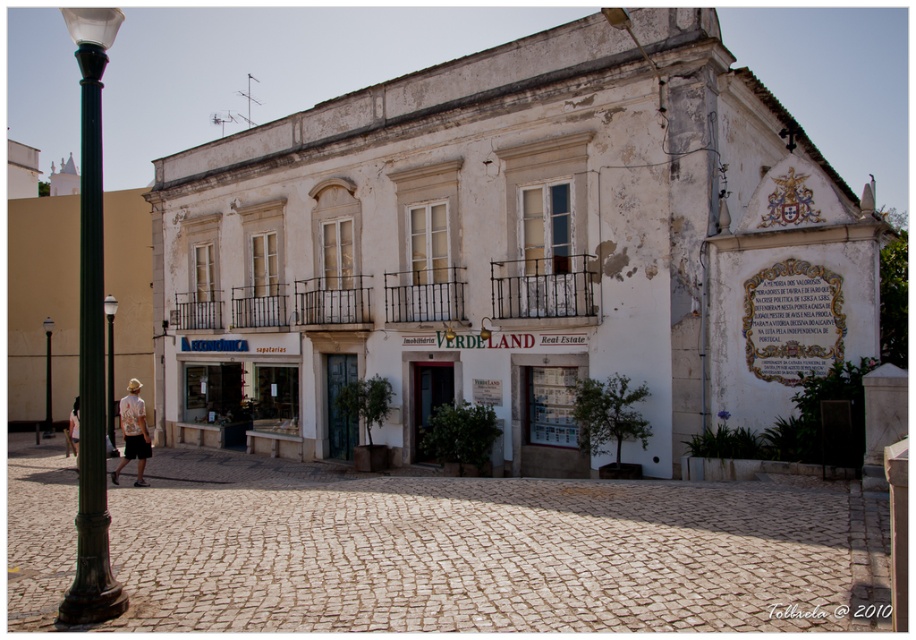
Which is more to the right, green polished metal lamp post at left or black glass lamp post at left?

Positioned to the right is black glass lamp post at left.

Which is below, green polished metal lamp post at left or black glass lamp post at left?

black glass lamp post at left is lower down.

Is point (104, 598) positioned in front of point (108, 308)?

Yes, point (104, 598) is closer to viewer.

This screenshot has height=640, width=916. What are the coordinates of `green polished metal lamp post at left` in the screenshot? It's located at (91, 333).

Is point (113, 436) positioned in front of point (45, 385)?

Yes, point (113, 436) is in front of point (45, 385).

Who is positioned more to the right, black glass lamp post at left or metallic pole at left?

black glass lamp post at left is more to the right.

What do you see at coordinates (110, 371) in the screenshot? This screenshot has height=640, width=916. I see `black glass lamp post at left` at bounding box center [110, 371].

Where is `black glass lamp post at left`? black glass lamp post at left is located at coordinates (110, 371).

Between point (113, 10) and point (139, 461), which one is positioned in front?

Positioned in front is point (113, 10).

Is point (97, 612) farther from camera compared to point (139, 451)?

No, (97, 612) is closer to viewer.

Does point (78, 554) lie in front of point (134, 452)?

That is True.

Where is `green polished metal lamp post at left`? The width and height of the screenshot is (916, 640). green polished metal lamp post at left is located at coordinates (91, 333).